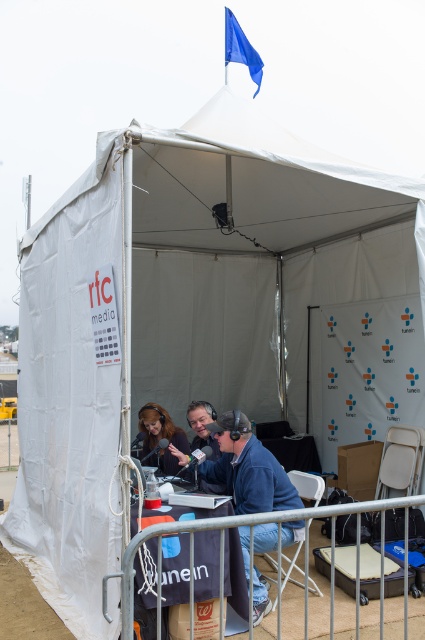
Which is more to the left, matte black headphones at center or white plastic chair at lower right?

matte black headphones at center

Which is behind, point (183, 440) or point (297, 552)?

The point (183, 440) is more distant.

This screenshot has height=640, width=425. What are the coordinates of `matte black headphones at center` in the screenshot? It's located at (159, 429).

Find the location of a particular element. The width and height of the screenshot is (425, 640). matte black headphones at center is located at coordinates (159, 429).

Is blue fabric jacket at center positioned behind white plastic chair at lower right?

No, blue fabric jacket at center is closer to the viewer.

Which is below, blue fabric jacket at center or white plastic chair at lower right?

white plastic chair at lower right is below.

Does point (231, 474) lie in front of point (314, 492)?

No, (231, 474) is behind (314, 492).

Where is `blue fabric jacket at center`? Image resolution: width=425 pixels, height=640 pixels. blue fabric jacket at center is located at coordinates (248, 468).

Is blue fabric jacket at center positioned behind matte black headphones at center?

No, blue fabric jacket at center is in front of matte black headphones at center.

Who is taller, blue fabric jacket at center or matte black headphones at center?

blue fabric jacket at center is taller.

Measure the distance between point (291, 490) and camera.

4.71 meters

I want to click on blue fabric jacket at center, so click(x=248, y=468).